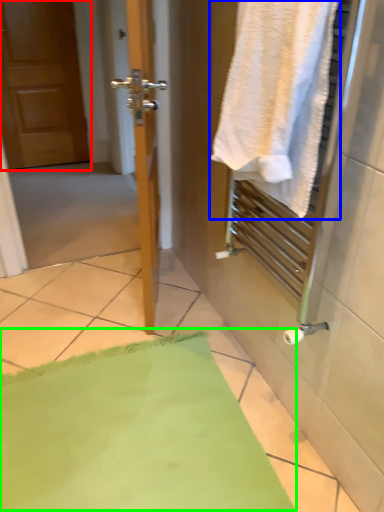
Question: Which object is the closest to the door (highlighted by a red box)? Choose among these: towel (highlighted by a blue box) or bath mat (highlighted by a green box).

Choices:
 (A) towel
 (B) bath mat

Answer: (B)